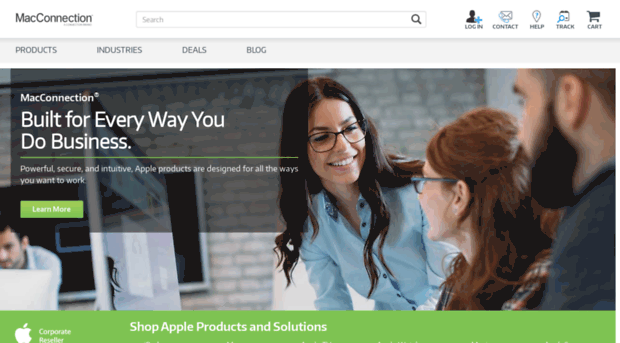
Identify the location of brick wall. This screenshot has width=620, height=343. (240, 215), (417, 104).